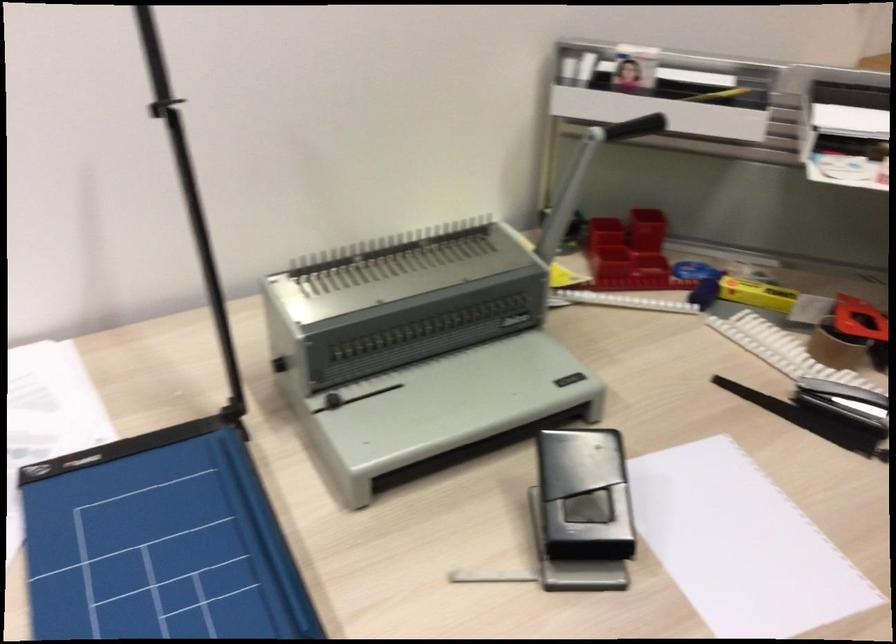
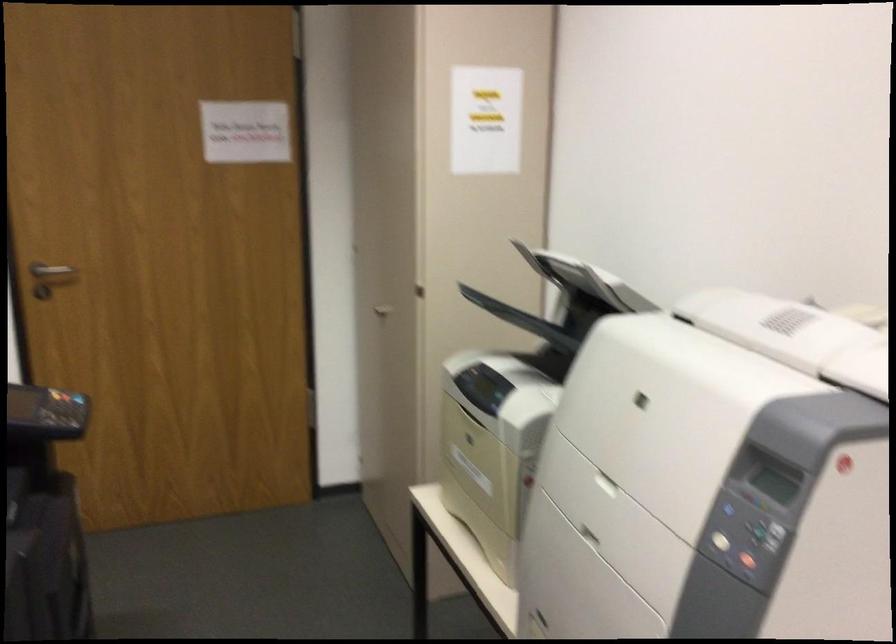
How did the camera likely rotate?

The camera's rotation is toward left-down.